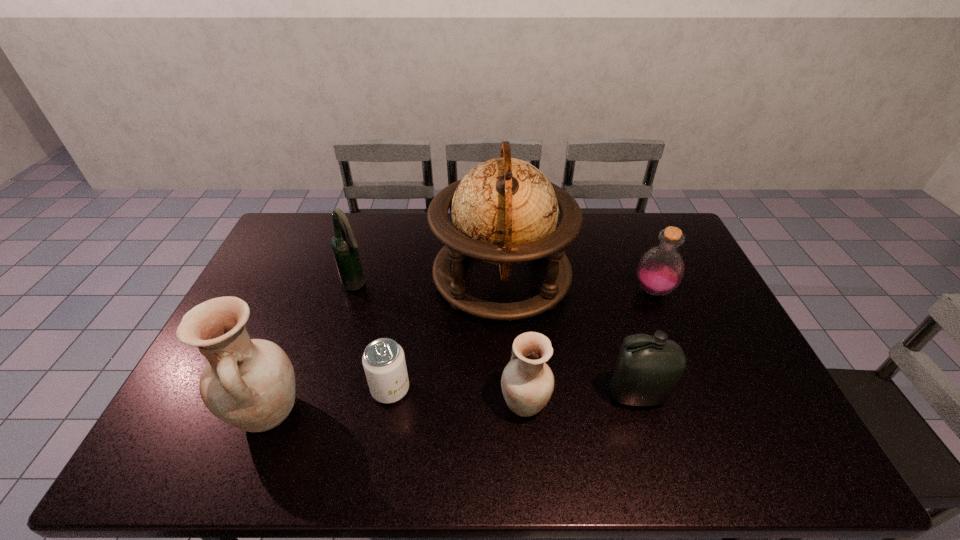
This screenshot has height=540, width=960. What are the coordinates of `empty space between the right pottery and the right bottle` in the screenshot? It's located at (588, 347).

At what (x,y) coordinates should I click in order to perform the action: click on vacant space that's between the right pottery and the right bottle. Please return your answer as a coordinate pair (x, y). The width and height of the screenshot is (960, 540). Looking at the image, I should click on pos(588,347).

The width and height of the screenshot is (960, 540). I want to click on vacant region between the taller pottery and the shorter pottery, so click(396, 409).

Where is `vacant point located between the third object from left to right and the shorter pottery`? vacant point located between the third object from left to right and the shorter pottery is located at coordinates (458, 396).

Where is `vacant point located between the beer bottle and the right pottery`? vacant point located between the beer bottle and the right pottery is located at coordinates (441, 344).

This screenshot has height=540, width=960. I want to click on free space between the farther bottle and the beer bottle, so click(x=505, y=288).

Find the location of a particular element. The image size is (960, 540). object that ranks as the third closest to the shortest object is located at coordinates (527, 382).

Identify which object is the third nearest to the nearer bottle. Please provide its 2D coordinates. Your answer should be formatted as a tuple, i.e. [(x, y)], where the tuple contains the x and y coordinates of a point satisfying the conditions above.

[(660, 270)]

Identify the location of vacant space that satisfies the following two spatial constraints: 1. on the back side of the nearer bottle; 2. on the right side of the taller pottery. (275, 395).

At what (x,y) coordinates should I click in order to perform the action: click on free space that satisfies the following two spatial constraints: 1. on the front side of the shortest object; 2. on the left side of the beer bottle. Please return your answer as a coordinate pair (x, y). This screenshot has height=540, width=960. Looking at the image, I should click on (324, 389).